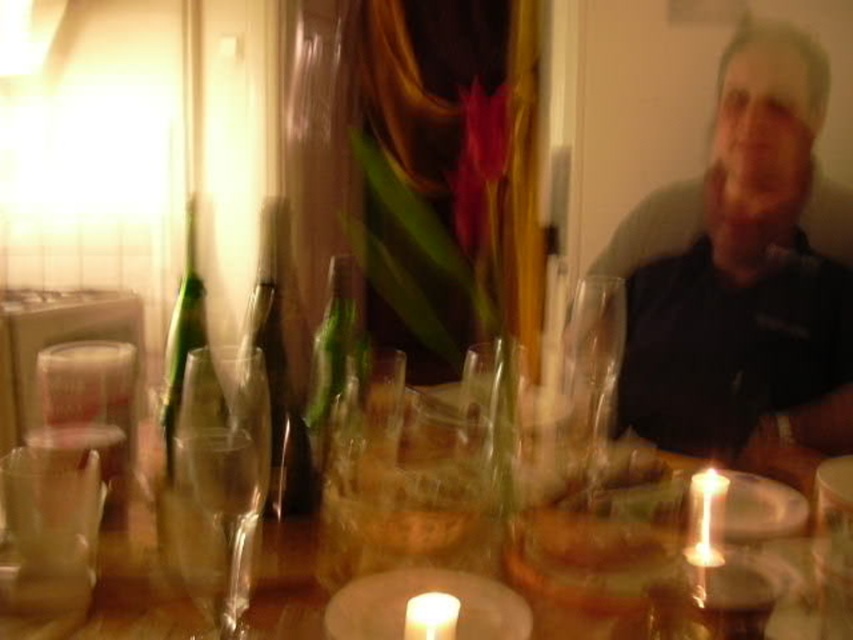
Question: Where is dark blue shirt at upper right located in relation to transparent glass wine glass at left in the image?

Choices:
 (A) below
 (B) above

Answer: (B)

Question: Which object appears farthest from the camera in this image?

Choices:
 (A) transparent glass wine glass at left
 (B) white wax candle at center
 (C) clear glass wine glass at center
 (D) dark blue shirt at upper right

Answer: (D)

Question: Where is transparent glass wine glass at left located in relation to white wax candle at center in the image?

Choices:
 (A) right
 (B) left

Answer: (B)

Question: Estimate the real-world distances between objects in this image. Which object is farther from the transparent glass wine glass at left?

Choices:
 (A) clear glass wine glass at center
 (B) dark blue shirt at upper right
 (C) matte white candle at center
 (D) white wax candle at center

Answer: (B)

Question: Which object appears farthest from the camera in this image?

Choices:
 (A) dark blue shirt at upper right
 (B) clear glass wine glass at center

Answer: (A)

Question: From the image, what is the correct spatial relationship of matte white candle at center in relation to white wax candle at center?

Choices:
 (A) above
 (B) below

Answer: (A)